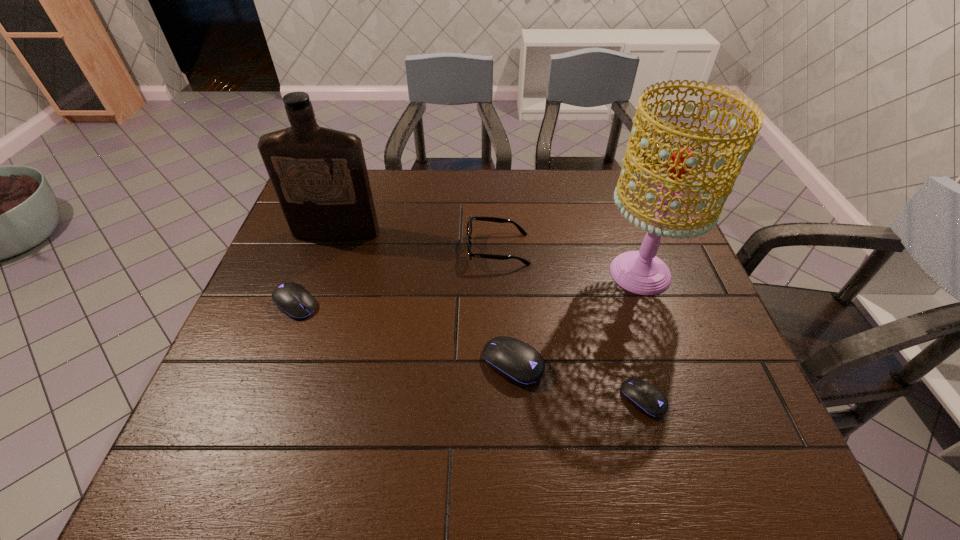
The image size is (960, 540). Find the location of `the fifth tallest object`. the fifth tallest object is located at coordinates (293, 299).

The image size is (960, 540). Find the location of `the farthest computer mouse`. the farthest computer mouse is located at coordinates point(293,299).

Locate an element on the screen. the second computer mouse from left to right is located at coordinates (518, 362).

You are a GUI agent. You are given a task and a screenshot of the screen. Output one action in this format:
    pyautogui.click(x=<x>, y=<y>)
    Task: Click on the third shortest object
    The height and width of the screenshot is (540, 960).
    Given the screenshot: What is the action you would take?
    pyautogui.click(x=518, y=362)

Locate an element on the screen. The width and height of the screenshot is (960, 540). the shortest object is located at coordinates (646, 398).

At what (x,y) coordinates should I click in order to perform the action: click on the rightmost computer mouse. Please return your answer as a coordinate pair (x, y). The height and width of the screenshot is (540, 960). Looking at the image, I should click on (646, 398).

Identify the location of lampshade. The height and width of the screenshot is (540, 960). (641, 272).

You are a GUI agent. You are given a task and a screenshot of the screen. Output one action in this format:
    pyautogui.click(x=<x>, y=<y>)
    Task: Click on the spectacles
    
    Given the screenshot: What is the action you would take?
    pyautogui.click(x=491, y=219)

Where is `liquor`? This screenshot has width=960, height=540. liquor is located at coordinates (319, 175).

Locate an element on the screen. Image resolution: width=960 pixels, height=540 pixels. free spot located 0.070m on the right of the fifth tallest object is located at coordinates (347, 304).